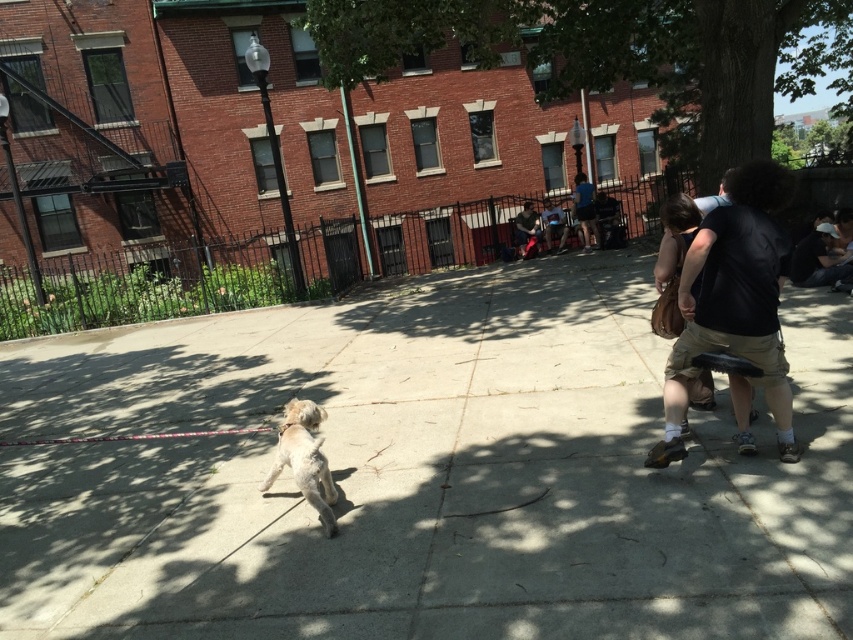
Question: Is blue fabric shirt at upper right closer to camera compared to dark blue jeans at center?

Choices:
 (A) no
 (B) yes

Answer: (B)

Question: Which object is closer to the camera taking this photo?

Choices:
 (A) dark blue jeans at center
 (B) dark brown leather jacket at right

Answer: (B)

Question: Is dark brown leather jacket at right to the left of light brown fur at lower left from the viewer's perspective?

Choices:
 (A) no
 (B) yes

Answer: (A)

Question: Based on their relative distances, which object is farther from the blue fabric shirt at upper right?

Choices:
 (A) light brown fur at lower left
 (B) smooth concrete pavement at center
 (C) dark blue jeans at center

Answer: (A)

Question: Is blue fabric shirt at upper right bigger than dark blue jeans at center?

Choices:
 (A) no
 (B) yes

Answer: (B)

Question: Among these objects, which one is nearest to the camera?

Choices:
 (A) blue fabric shirt at upper right
 (B) dark blue jeans at center
 (C) light brown fur at lower left
 (D) smooth concrete pavement at center

Answer: (D)